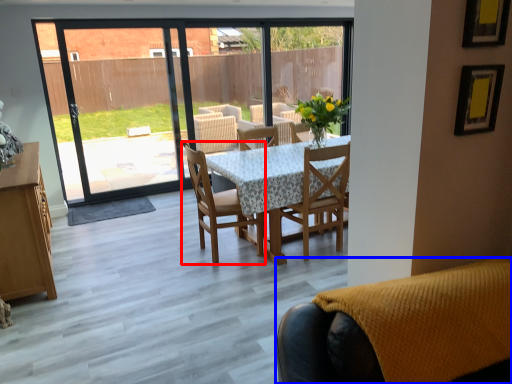
Question: Which object is closer to the camera taking this photo, chair (highlighted by a red box) or chair (highlighted by a blue box)?

Choices:
 (A) chair
 (B) chair

Answer: (B)